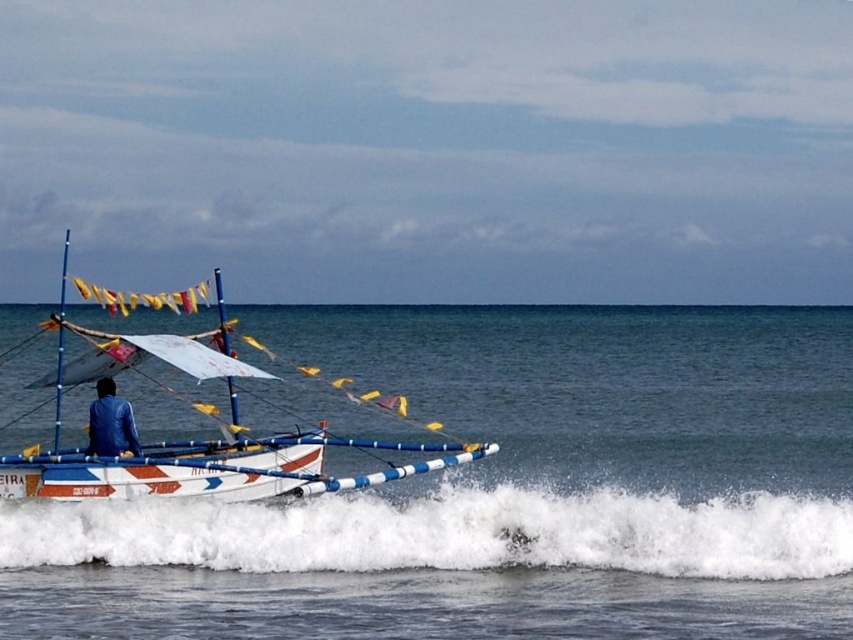
Question: Which point is closer to the camera?

Choices:
 (A) blue fabric jacket at left
 (B) white frothy water at lower center

Answer: (B)

Question: Can you confirm if white frothy water at lower center is wider than white plastic boat at left?

Choices:
 (A) no
 (B) yes

Answer: (B)

Question: Which object is the closest to the blue fabric jacket at left?

Choices:
 (A) white frothy water at lower center
 (B) white frothy wave at lower center
 (C) white plastic boat at left

Answer: (B)

Question: Which point is farther to the camera?

Choices:
 (A) white frothy water at lower center
 (B) blue fabric jacket at left
 (C) white frothy wave at lower center

Answer: (B)

Question: Is white frothy water at lower center positioned behind white frothy wave at lower center?

Choices:
 (A) yes
 (B) no

Answer: (B)

Question: Is white frothy wave at lower center thinner than white plastic boat at left?

Choices:
 (A) yes
 (B) no

Answer: (A)